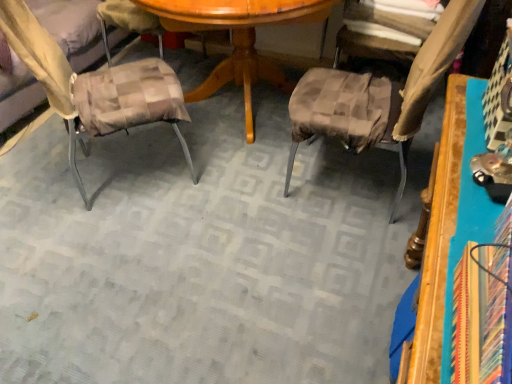
Question: Can you confirm if wooden table at right is taller than brown checkered cushion at center, placed as the 1th chair when sorted from right to left?

Choices:
 (A) no
 (B) yes

Answer: (A)

Question: Is wooden table at right not within brown checkered cushion at center, placed as the 1th chair when sorted from right to left?

Choices:
 (A) yes
 (B) no

Answer: (A)

Question: Is wooden table at right in front of brown checkered cushion at center, placed as the 1th chair when sorted from right to left?

Choices:
 (A) no
 (B) yes

Answer: (B)

Question: Can brown checkered cushion at center, placed as the 1th chair when sorted from right to left, be found inside wooden table at right?

Choices:
 (A) yes
 (B) no

Answer: (B)

Question: Can you confirm if wooden table at right is wider than brown checkered cushion at center, placed as the 1th chair when sorted from right to left?

Choices:
 (A) no
 (B) yes

Answer: (A)

Question: Is wooden table at right positioned far away from brown checkered cushion at center, the second chair from the left?

Choices:
 (A) yes
 (B) no

Answer: (B)

Question: Can you confirm if plaid fabric cushion at left, the 1th chair positioned from the left, is bigger than wooden table at right?

Choices:
 (A) no
 (B) yes

Answer: (B)

Question: Is plaid fabric cushion at left, the second chair from the right, oriented towards wooden table at right?

Choices:
 (A) yes
 (B) no

Answer: (A)

Question: From the image's perspective, does plaid fabric cushion at left, the second chair from the right, appear lower than wooden table at right?

Choices:
 (A) yes
 (B) no

Answer: (B)

Question: From a real-world perspective, is plaid fabric cushion at left, the 1th chair positioned from the left, positioned under wooden table at right based on gravity?

Choices:
 (A) no
 (B) yes

Answer: (B)

Question: Can we say plaid fabric cushion at left, the 1th chair positioned from the left, lies outside wooden table at right?

Choices:
 (A) no
 (B) yes

Answer: (B)

Question: Does plaid fabric cushion at left, the 1th chair positioned from the left, have a greater width compared to wooden table at right?

Choices:
 (A) yes
 (B) no

Answer: (A)

Question: From a real-world perspective, is plaid fabric cushion at left, the 1th chair positioned from the left, over brown textured fabric at upper right?

Choices:
 (A) yes
 (B) no

Answer: (B)